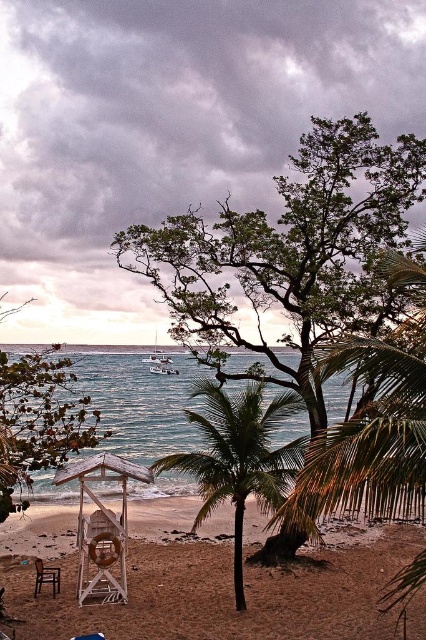
Question: Does green leafy tree at center have a greater width compared to white plastic lifeguard chair at lower center?

Choices:
 (A) yes
 (B) no

Answer: (B)

Question: Which point is closer to the camera?

Choices:
 (A) green leafy tree at upper left
 (B) wooden beach chair at lower left
 (C) white plastic lifeguard chair at lower center
 (D) green leafy tree at center

Answer: (A)

Question: Can you confirm if green leafy palm tree at center is positioned below green leafy tree at upper left?

Choices:
 (A) no
 (B) yes

Answer: (B)

Question: Which object is closer to the camera taking this photo?

Choices:
 (A) white plastic lifeguard chair at lower center
 (B) green leafy tree at center
 (C) green leafy palm tree at center
 (D) wooden beach chair at lower left

Answer: (A)

Question: Does clear blue water at center lie in front of green leafy tree at upper left?

Choices:
 (A) yes
 (B) no

Answer: (B)

Question: Which object appears farthest from the camera in this image?

Choices:
 (A) wooden beach chair at lower left
 (B) green leafy tree at center

Answer: (B)